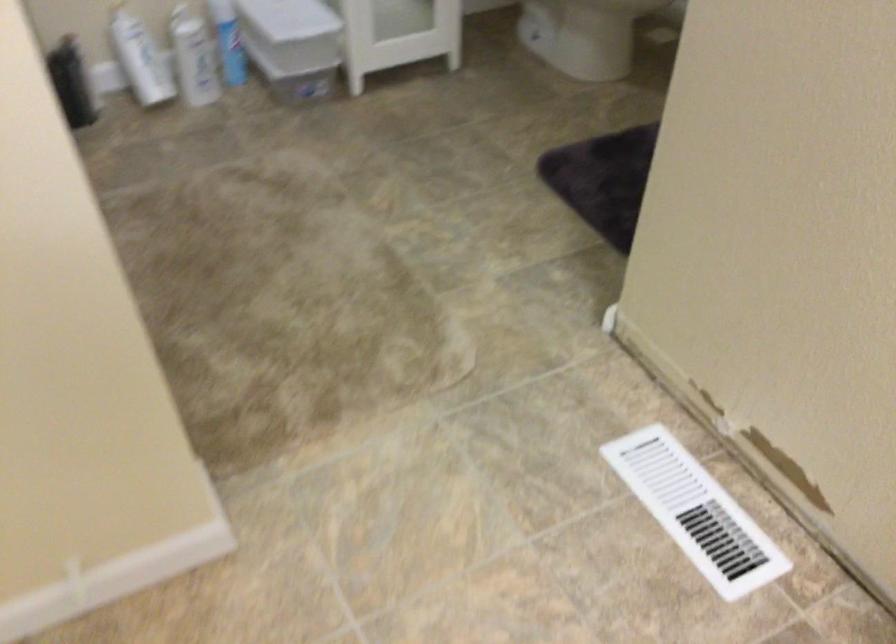
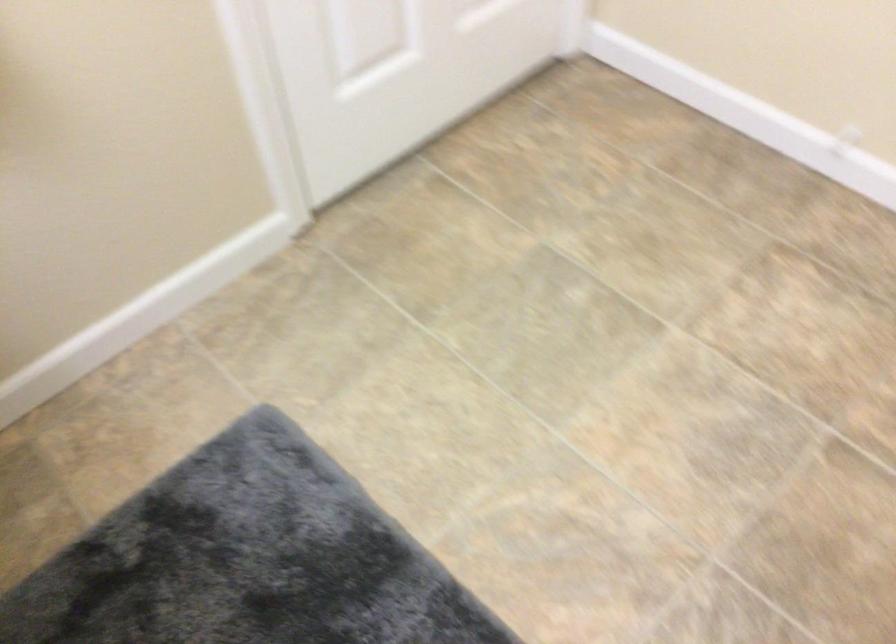
Based on the continuous images, in which direction is the camera rotating?

The camera rotated toward left-down.